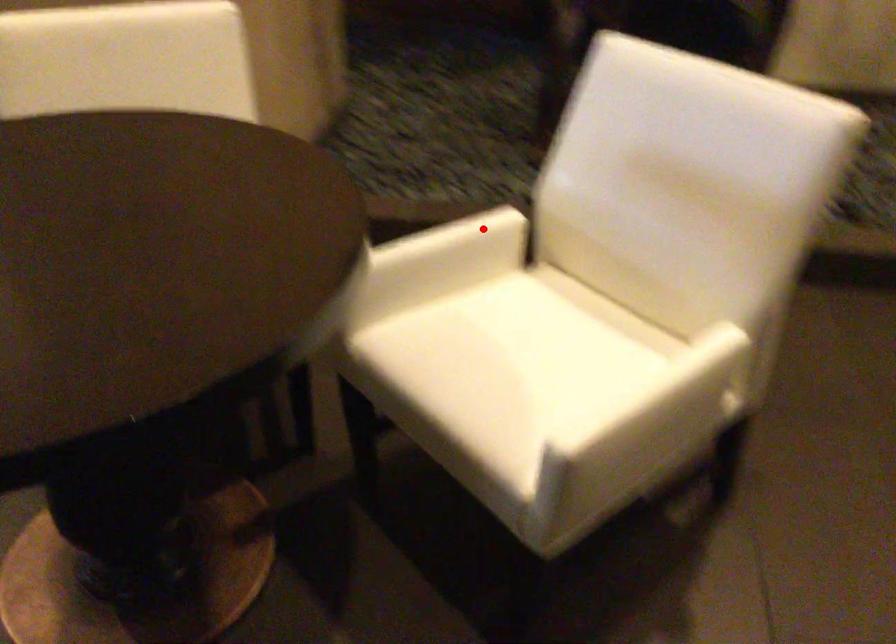
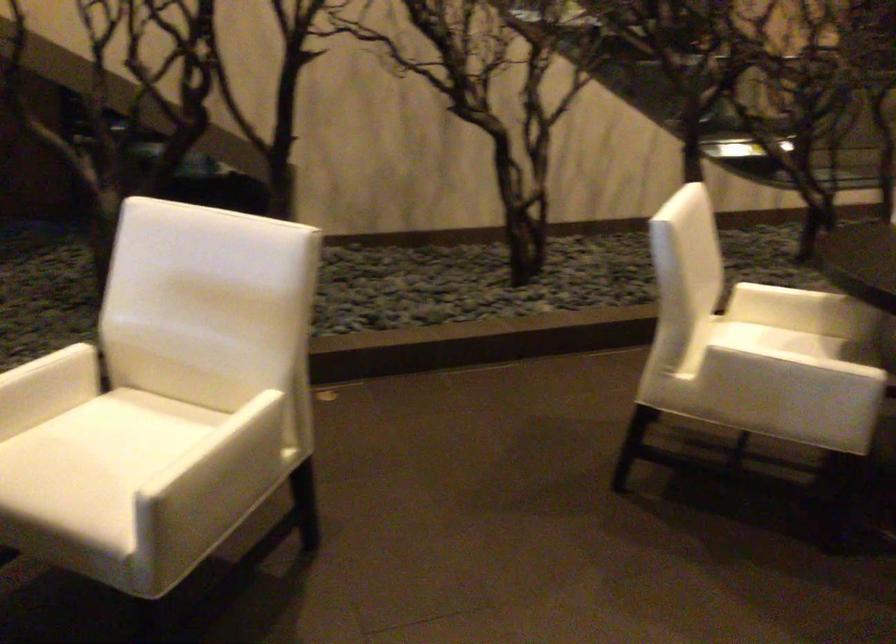
Question: I am providing you with two images of the same scene from different viewpoints. A red point is shown in image1. For the corresponding object point in image2, is it positioned nearer or farther from the camera?

Choices:
 (A) Nearer
 (B) Farther

Answer: (B)